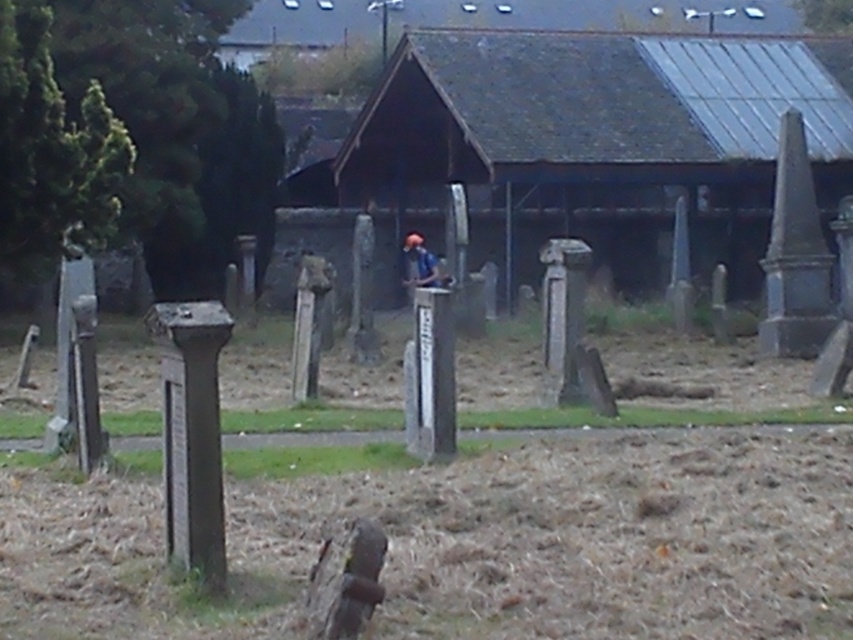
Question: Where is dark gray wooden hut at center located in relation to matte blue shirt at center in the image?

Choices:
 (A) left
 (B) right

Answer: (B)

Question: Which point is farther from the camera taking this photo?

Choices:
 (A) (410, 269)
 (B) (756, 192)

Answer: (B)

Question: Is dark gray wooden hut at center in front of matte blue shirt at center?

Choices:
 (A) no
 (B) yes

Answer: (B)

Question: Which point is closer to the camera?

Choices:
 (A) (410, 288)
 (B) (636, 138)

Answer: (B)

Question: Can you confirm if dark gray wooden hut at center is positioned to the right of matte blue shirt at center?

Choices:
 (A) no
 (B) yes

Answer: (B)